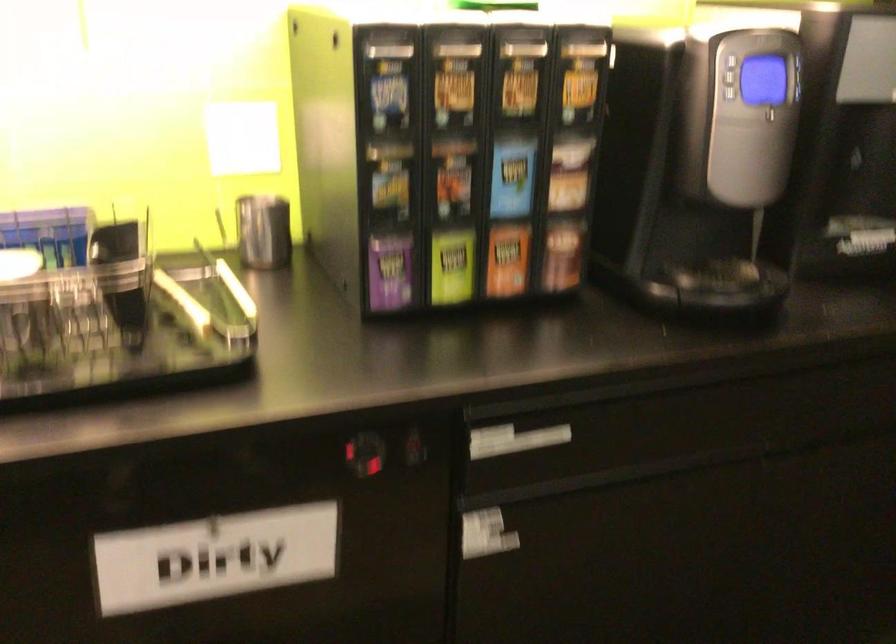
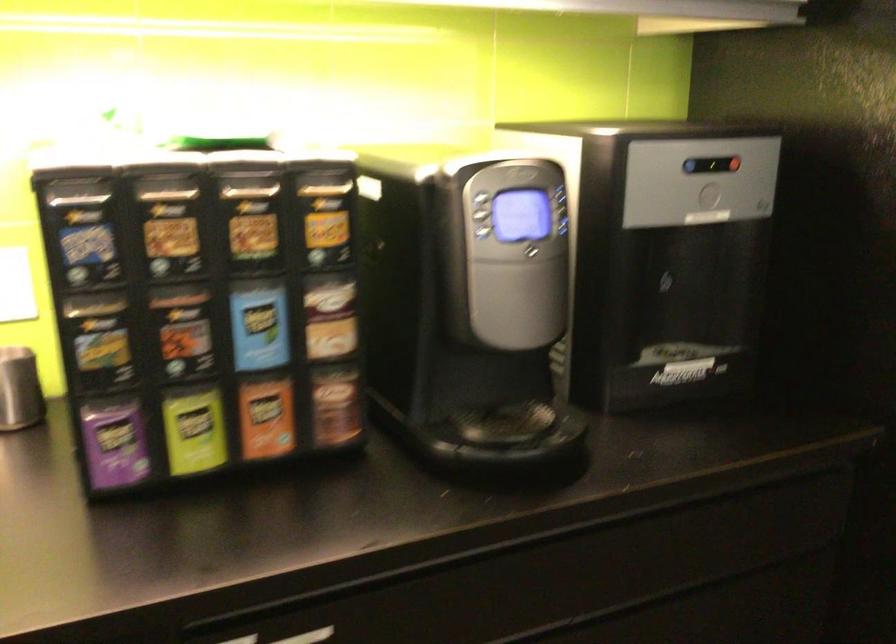
Question: I am providing you with two images of the same scene from different viewpoints. Which of the following objects are not visible in image2?

Choices:
 (A) tea bag packet
 (B) silver cabinet handle
 (C) red dispenser button
 (D) none of these

Answer: (D)